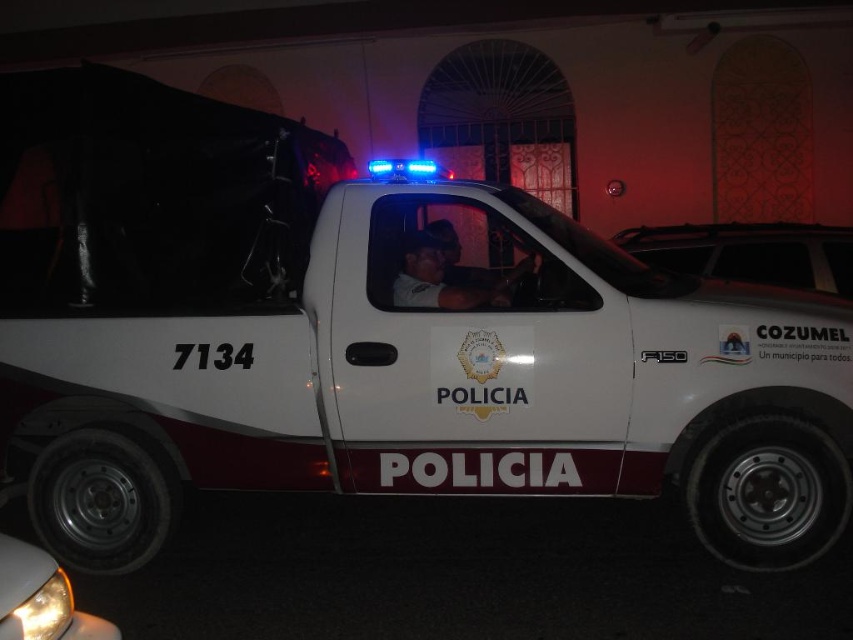
You are standing in front of the police vehicle and want to know where the white matte windshield at upper center is located. What are its coordinates?

The white matte windshield at upper center is located at coordinates point (749, 252).

You are standing in front of the white police vehicle parked outside the building. There are two points marked on the vehicle. The first point is at coordinate point (844, 282) and the second is at coordinate point (109, 621). Which point is closer to you?

Point (844, 282) is further to the viewer than point (109, 621), so the point closer to you is point (109, 621).